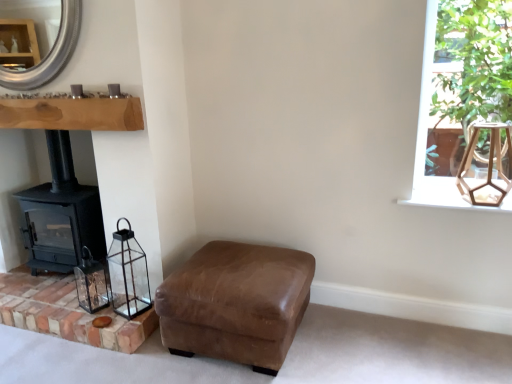
You are a GUI agent. You are given a task and a screenshot of the screen. Output one action in this format:
    pyautogui.click(x=<x>, y=<y>)
    Task: Click on the free space in front of black matte wood burning stove at left
    
    Given the screenshot: What is the action you would take?
    pyautogui.click(x=54, y=297)